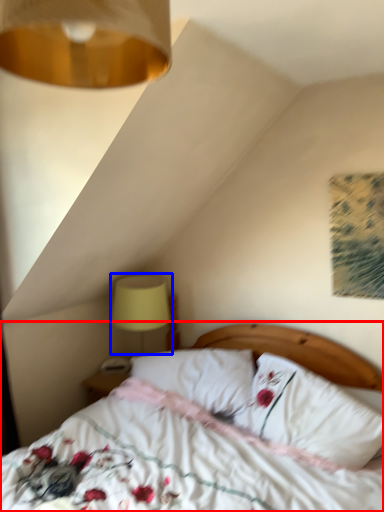
Question: Which of the following is the farthest to the observer, bed (highlighted by a red box) or table lamp (highlighted by a blue box)?

Choices:
 (A) bed
 (B) table lamp

Answer: (B)